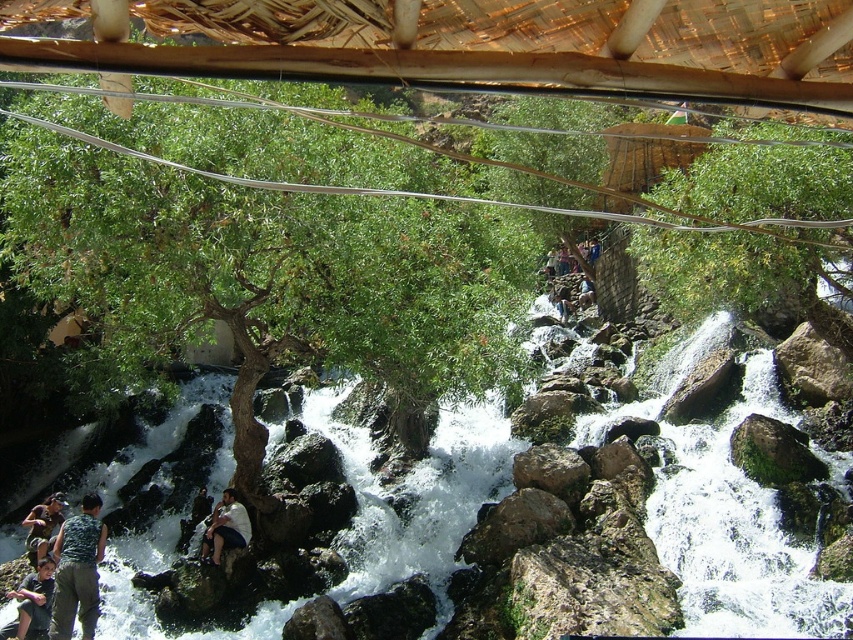
Who is taller, green leafy tree at upper center or camouflage pants at lower left?

green leafy tree at upper center

Where is `green leafy tree at upper center`? green leafy tree at upper center is located at coordinates (764, 179).

Does point (683, 252) lie in front of point (97, 538)?

No, it is not.

In order to click on green leafy tree at upper center in this screenshot , I will do `click(764, 179)`.

Who is lower down, green leafy tree at center or camouflage pants at lower left?

camouflage pants at lower left is below.

Between green leafy tree at center and camouflage pants at lower left, which one is positioned higher?

green leafy tree at center is higher up.

Is point (102, 314) positioned before point (90, 525)?

No.

In order to click on green leafy tree at center in this screenshot , I will do `click(270, 250)`.

Who is positioned more to the left, green leafy tree at center or green leafy tree at upper center?

green leafy tree at center

Is green leafy tree at center thinner than green leafy tree at upper center?

In fact, green leafy tree at center might be wider than green leafy tree at upper center.

Identify the location of green leafy tree at center. (270, 250).